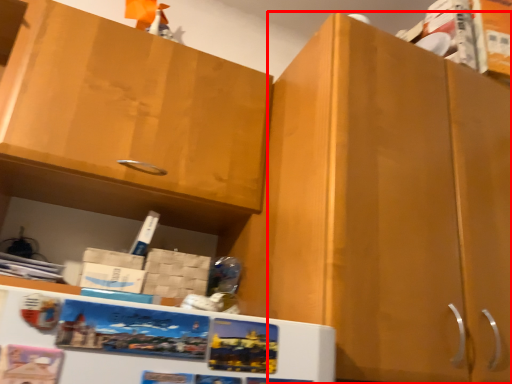
Question: Considering the relative positions of cabinetry (annotated by the red box) and cabinetry in the image provided, where is cabinetry (annotated by the red box) located with respect to the staircase?

Choices:
 (A) left
 (B) right

Answer: (B)